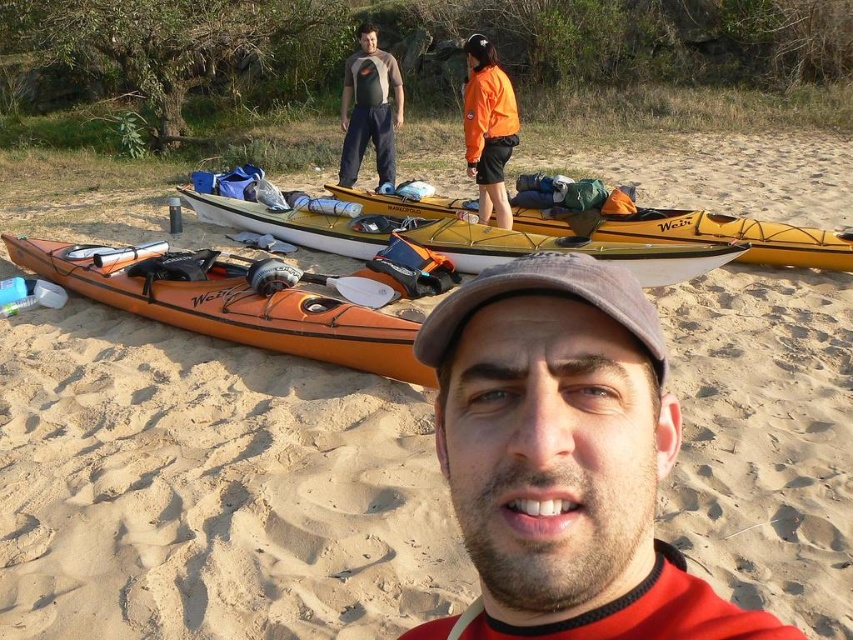
Is orange matte kayak at lower left positioned before orange fleece jacket at upper center?

That is True.

Between point (96, 288) and point (505, 86), which one is positioned in front?

Positioned in front is point (96, 288).

Locate an element on the screen. orange matte kayak at lower left is located at coordinates (236, 310).

Can you confirm if yellow matte kayak at center is positioned above gray fabric baseball cap at center?

Yes.

Between yellow matte kayak at center and gray fabric baseball cap at center, which one is positioned higher?

yellow matte kayak at center

This screenshot has width=853, height=640. Identify the location of yellow matte kayak at center. (701, 234).

You are a GUI agent. You are given a task and a screenshot of the screen. Output one action in this format:
    pyautogui.click(x=<x>, y=<y>)
    Task: Click on the matte gray cap at center
    
    Given the screenshot: What is the action you would take?
    pyautogui.click(x=566, y=456)

Can you confirm if matte gray cap at center is positioned to the right of gray fabric baseball cap at center?

Indeed, matte gray cap at center is positioned on the right side of gray fabric baseball cap at center.

The image size is (853, 640). Identify the location of matte gray cap at center. (566, 456).

Image resolution: width=853 pixels, height=640 pixels. What are the coordinates of `matte gray cap at center` in the screenshot? It's located at (566, 456).